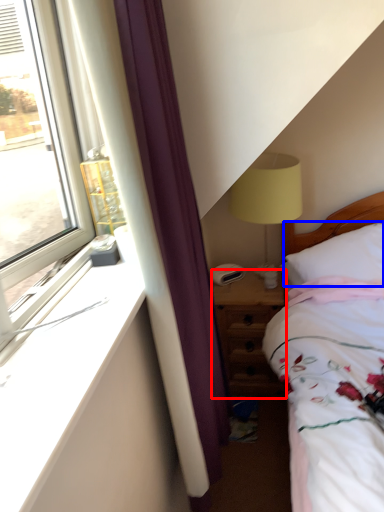
Question: Which object appears closest to the camera in this image, nightstand (highlighted by a red box) or pillow (highlighted by a blue box)?

Choices:
 (A) nightstand
 (B) pillow

Answer: (B)